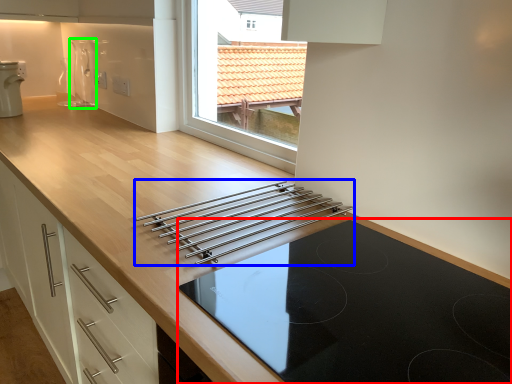
Question: Considering the real-world distances, which object is closest to gas stove (highlighted by a red box)? kitchen appliance (highlighted by a blue box) or appliance (highlighted by a green box).

Choices:
 (A) kitchen appliance
 (B) appliance

Answer: (A)